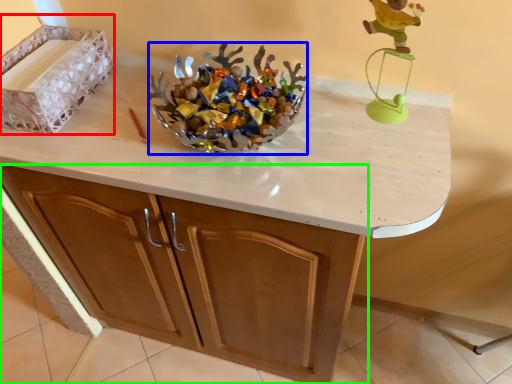
Question: Which is farther away from crate (highlighted by a red box)? stuff (highlighted by a blue box) or cabinetry (highlighted by a green box)?

Choices:
 (A) stuff
 (B) cabinetry

Answer: (B)